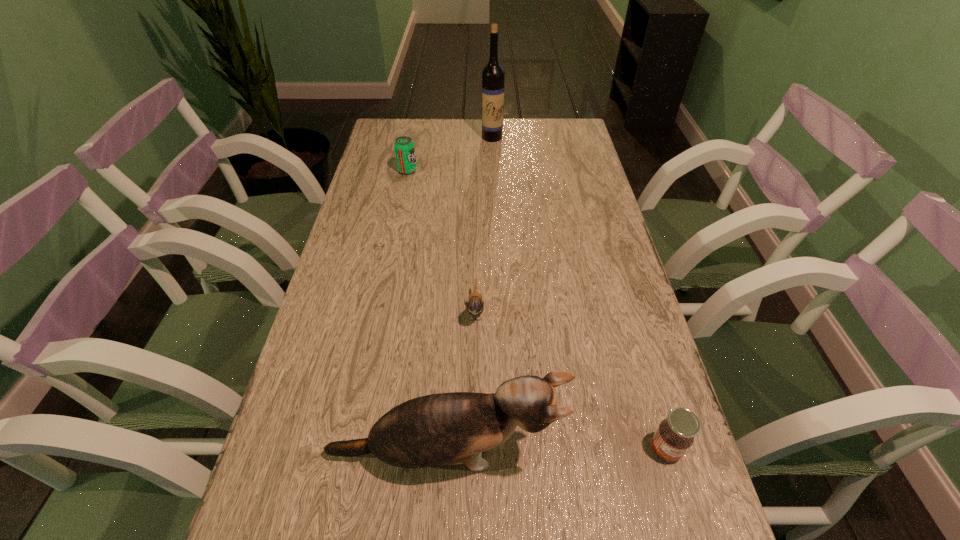
This screenshot has width=960, height=540. Identify the location of unoccupied position between the second farthest object and the rightmost object. (537, 309).

Locate an element on the screen. This screenshot has width=960, height=540. free space that is in between the pop soda and the third nearest object is located at coordinates (442, 240).

You are a GUI agent. You are given a task and a screenshot of the screen. Output one action in this format:
    pyautogui.click(x=<x>, y=<y>)
    Task: Click on the free space between the rightmost object and the pop soda
    Image resolution: width=960 pixels, height=540 pixels.
    Given the screenshot: What is the action you would take?
    pyautogui.click(x=537, y=309)

Image resolution: width=960 pixels, height=540 pixels. Identify the location of vacant space that is in between the shortest object and the cat. (459, 382).

Where is `vacant area that lies between the pop soda and the shortest object`? Image resolution: width=960 pixels, height=540 pixels. vacant area that lies between the pop soda and the shortest object is located at coordinates (442, 240).

The image size is (960, 540). Find the location of `unoccupied area between the pop soda and the rightmost object`. unoccupied area between the pop soda and the rightmost object is located at coordinates (537, 309).

Locate an element on the screen. The height and width of the screenshot is (540, 960). empty location between the pop soda and the second tallest object is located at coordinates (425, 313).

Find the location of a particular element. Image resolution: width=960 pixels, height=540 pixels. vacant space in between the second tallest object and the tallest object is located at coordinates (468, 296).

The width and height of the screenshot is (960, 540). I want to click on blank region between the tallest object and the jam, so click(579, 293).

At what (x,y) coordinates should I click in order to perform the action: click on vacant area that lies between the shortest object and the cat. Please return your answer as a coordinate pair (x, y). This screenshot has width=960, height=540. Looking at the image, I should click on (459, 382).